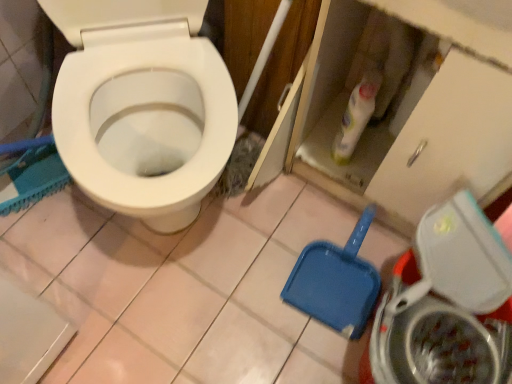
Question: Is metallic silver washing machine at lower right closer to camera compared to white glossy bottle at upper center?

Choices:
 (A) no
 (B) yes

Answer: (B)

Question: From the image's perspective, is metallic silver washing machine at lower right above white glossy bottle at upper center?

Choices:
 (A) no
 (B) yes

Answer: (A)

Question: Is metallic silver washing machine at lower right aimed at white glossy bottle at upper center?

Choices:
 (A) yes
 (B) no

Answer: (B)

Question: Considering the relative sizes of metallic silver washing machine at lower right and white glossy bottle at upper center in the image provided, is metallic silver washing machine at lower right taller than white glossy bottle at upper center?

Choices:
 (A) no
 (B) yes

Answer: (B)

Question: Can you confirm if metallic silver washing machine at lower right is positioned to the right of white glossy bottle at upper center?

Choices:
 (A) yes
 (B) no

Answer: (A)

Question: Looking at their shapes, would you say white glossy bottle at upper center is wider or thinner than metallic silver washing machine at lower right?

Choices:
 (A) wide
 (B) thin

Answer: (B)

Question: From the image's perspective, is white glossy bottle at upper center above or below metallic silver washing machine at lower right?

Choices:
 (A) below
 (B) above

Answer: (B)

Question: Is white glossy bottle at upper center bigger or smaller than metallic silver washing machine at lower right?

Choices:
 (A) big
 (B) small

Answer: (B)

Question: Is white glossy bottle at upper center in front of or behind metallic silver washing machine at lower right in the image?

Choices:
 (A) behind
 (B) front

Answer: (A)

Question: Do you think metallic silver washing machine at lower right is within white glossy bottle at upper center, or outside of it?

Choices:
 (A) outside
 (B) inside

Answer: (A)

Question: Considering the relative positions of metallic silver washing machine at lower right and white glossy bottle at upper center in the image provided, is metallic silver washing machine at lower right to the left or to the right of white glossy bottle at upper center?

Choices:
 (A) left
 (B) right

Answer: (B)

Question: Considering the positions of point (484, 319) and point (343, 125), is point (484, 319) closer or farther from the camera than point (343, 125)?

Choices:
 (A) closer
 (B) farther

Answer: (A)

Question: From a real-world perspective, relative to white glossy bottle at upper center, is metallic silver washing machine at lower right vertically above or below?

Choices:
 (A) below
 (B) above

Answer: (A)

Question: Relative to white glossy bottle at upper center, is blue plastic shovel at lower right in front or behind?

Choices:
 (A) front
 (B) behind

Answer: (B)

Question: Do you think blue plastic shovel at lower right is within white glossy bottle at upper center, or outside of it?

Choices:
 (A) inside
 (B) outside

Answer: (B)